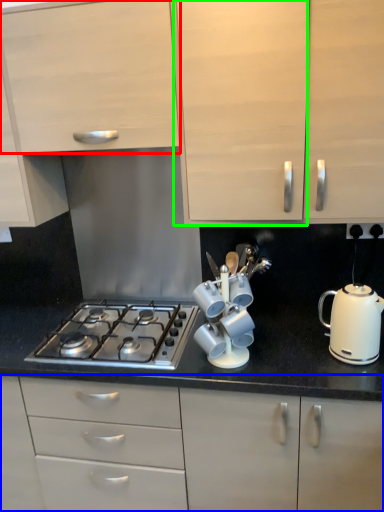
Question: Estimate the real-world distances between objects in this image. Which object is farther from cabinetry (highlighted by a red box), cabinetry (highlighted by a blue box) or cabinetry (highlighted by a green box)?

Choices:
 (A) cabinetry
 (B) cabinetry

Answer: (A)